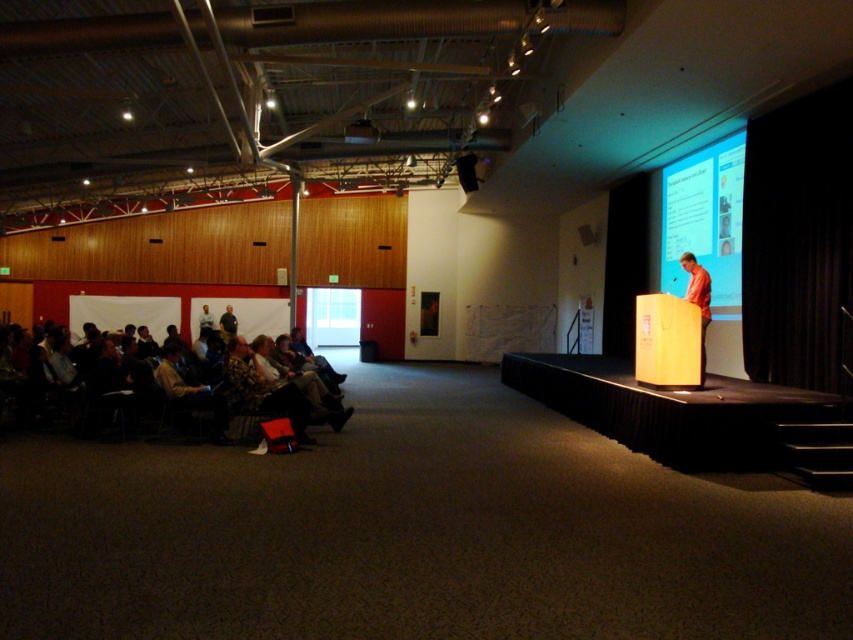
Question: Which object is the closest to the orange fabric shirt at stage right?

Choices:
 (A) dark brown fabric chairs at left
 (B) matte white screen at upper right

Answer: (B)

Question: Which object appears closest to the camera in this image?

Choices:
 (A) matte white screen at upper right
 (B) orange fabric shirt at stage right
 (C) dark gray fabric jacket at lower left

Answer: (B)

Question: From the image, what is the correct spatial relationship of orange fabric shirt at stage right in relation to dark gray fabric jacket at lower left?

Choices:
 (A) left
 (B) right

Answer: (B)

Question: Which object is positioned farthest from the dark gray fabric jacket at lower left?

Choices:
 (A) matte white screen at upper right
 (B) dark brown fabric chairs at left

Answer: (A)

Question: Does matte white screen at upper right come in front of dark gray fabric jacket at lower left?

Choices:
 (A) yes
 (B) no

Answer: (A)

Question: Can you confirm if dark brown fabric chairs at left is positioned to the left of dark gray fabric jacket at lower left?

Choices:
 (A) yes
 (B) no

Answer: (B)